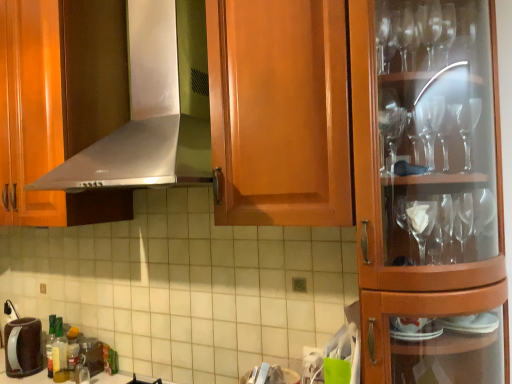
Question: Is satin silver exhaust hood at upper center positioned in front of brown matte coffee pot at lower left, positioned as the second appliance in right-to-left order?

Choices:
 (A) no
 (B) yes

Answer: (B)

Question: Would you consider satin silver exhaust hood at upper center to be distant from brown matte coffee pot at lower left, which is counted as the 1th appliance, starting from the left?

Choices:
 (A) no
 (B) yes

Answer: (B)

Question: Is satin silver exhaust hood at upper center outside of brown matte coffee pot at lower left, which is counted as the 1th appliance, starting from the left?

Choices:
 (A) no
 (B) yes

Answer: (B)

Question: Is satin silver exhaust hood at upper center bigger than brown matte coffee pot at lower left, which is counted as the 1th appliance, starting from the left?

Choices:
 (A) no
 (B) yes

Answer: (B)

Question: Can you confirm if satin silver exhaust hood at upper center is positioned to the left of brown matte coffee pot at lower left, positioned as the second appliance in right-to-left order?

Choices:
 (A) no
 (B) yes

Answer: (A)

Question: Looking at their shapes, would you say translucent plastic bottle at lower left is wider or thinner than brown matte coffee pot at lower left, which is counted as the 1th appliance, starting from the left?

Choices:
 (A) wide
 (B) thin

Answer: (B)

Question: Based on their sizes in the image, would you say translucent plastic bottle at lower left is bigger or smaller than brown matte coffee pot at lower left, positioned as the second appliance in right-to-left order?

Choices:
 (A) small
 (B) big

Answer: (A)

Question: Is translucent plastic bottle at lower left spatially inside brown matte coffee pot at lower left, positioned as the second appliance in right-to-left order, or outside of it?

Choices:
 (A) inside
 (B) outside

Answer: (B)

Question: In the image, is translucent plastic bottle at lower left positioned in front of or behind brown matte coffee pot at lower left, positioned as the second appliance in right-to-left order?

Choices:
 (A) behind
 (B) front

Answer: (B)

Question: Relative to metallic silver coffee maker at lower left, which is the 1th appliance in right-to-left order, is brown matte coffee pot at lower left, which is counted as the 1th appliance, starting from the left, in front or behind?

Choices:
 (A) front
 (B) behind

Answer: (A)

Question: Is brown matte coffee pot at lower left, which is counted as the 1th appliance, starting from the left, wider or thinner than metallic silver coffee maker at lower left, which is the 1th appliance in right-to-left order?

Choices:
 (A) thin
 (B) wide

Answer: (B)

Question: From a real-world perspective, is brown matte coffee pot at lower left, which is counted as the 1th appliance, starting from the left, above or below metallic silver coffee maker at lower left, which is the second appliance in left-to-right order?

Choices:
 (A) below
 (B) above

Answer: (B)

Question: Based on their sizes in the image, would you say brown matte coffee pot at lower left, positioned as the second appliance in right-to-left order, is bigger or smaller than metallic silver coffee maker at lower left, which is the second appliance in left-to-right order?

Choices:
 (A) small
 (B) big

Answer: (B)

Question: From the image's perspective, is metallic silver coffee maker at lower left, which is the second appliance in left-to-right order, located above or below translucent plastic bottle at lower left?

Choices:
 (A) below
 (B) above

Answer: (A)

Question: Considering the positions of metallic silver coffee maker at lower left, which is the second appliance in left-to-right order, and translucent plastic bottle at lower left in the image, is metallic silver coffee maker at lower left, which is the second appliance in left-to-right order, bigger or smaller than translucent plastic bottle at lower left?

Choices:
 (A) small
 (B) big

Answer: (A)